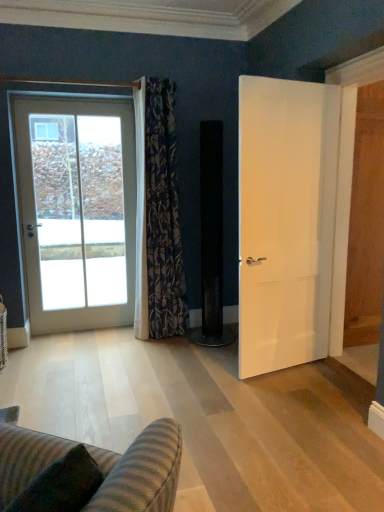
Question: In the image, is floral-patterned fabric curtain at left positioned in front of or behind white matte door at right, the first door in the front-to-back sequence?

Choices:
 (A) behind
 (B) front

Answer: (A)

Question: Considering the positions of floral-patterned fabric curtain at left and white matte door at right, which is the 2th door from back to front, in the image, is floral-patterned fabric curtain at left wider or thinner than white matte door at right, which is the 2th door from back to front,?

Choices:
 (A) wide
 (B) thin

Answer: (A)

Question: Which of these objects is positioned farthest from the white matte door at right, the first door in the front-to-back sequence?

Choices:
 (A) white glass door at left, which is counted as the 1th door, starting from the left
 (B) floral-patterned fabric curtain at left
 (C) striped fabric couch at lower left

Answer: (C)

Question: Which is nearer to the white matte door at right, the first door in the front-to-back sequence?

Choices:
 (A) floral-patterned fabric curtain at left
 (B) white glass door at left, which ranks as the second door in right-to-left order
 (C) striped fabric couch at lower left

Answer: (A)